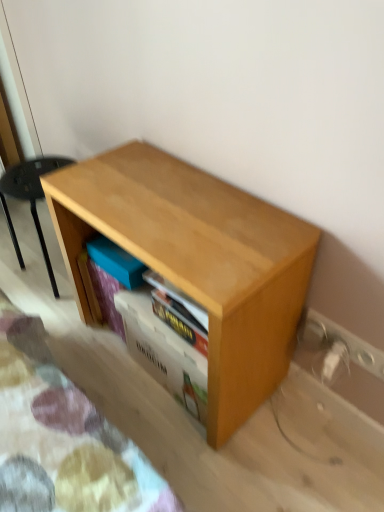
At what (x,y) coordinates should I click in order to perform the action: click on free space on the front side of light wood table at center. Please return your answer as a coordinate pair (x, y). Looking at the image, I should click on (216, 450).